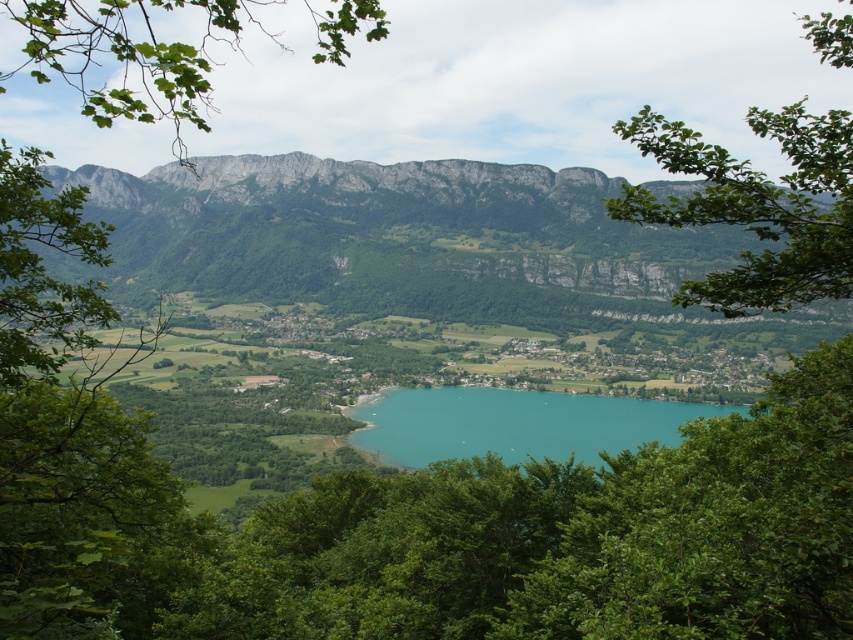
Question: Estimate the real-world distances between objects in this image. Which object is farther from the green leafy branch at upper right?

Choices:
 (A) gray rocky mountain at center
 (B) turquoise glassy water at center

Answer: (A)

Question: Estimate the real-world distances between objects in this image. Which object is farther from the green leafy branch at upper right?

Choices:
 (A) turquoise glassy water at center
 (B) gray rocky mountain at center

Answer: (B)

Question: Does gray rocky mountain at center have a lesser width compared to green leafy branch at upper right?

Choices:
 (A) no
 (B) yes

Answer: (A)

Question: Which object is positioned farthest from the green leafy branch at upper right?

Choices:
 (A) turquoise glassy water at center
 (B) gray rocky mountain at center

Answer: (B)

Question: Can you confirm if gray rocky mountain at center is positioned to the left of green leafy branch at upper right?

Choices:
 (A) no
 (B) yes

Answer: (B)

Question: Is gray rocky mountain at center positioned behind green leafy branch at upper right?

Choices:
 (A) yes
 (B) no

Answer: (A)